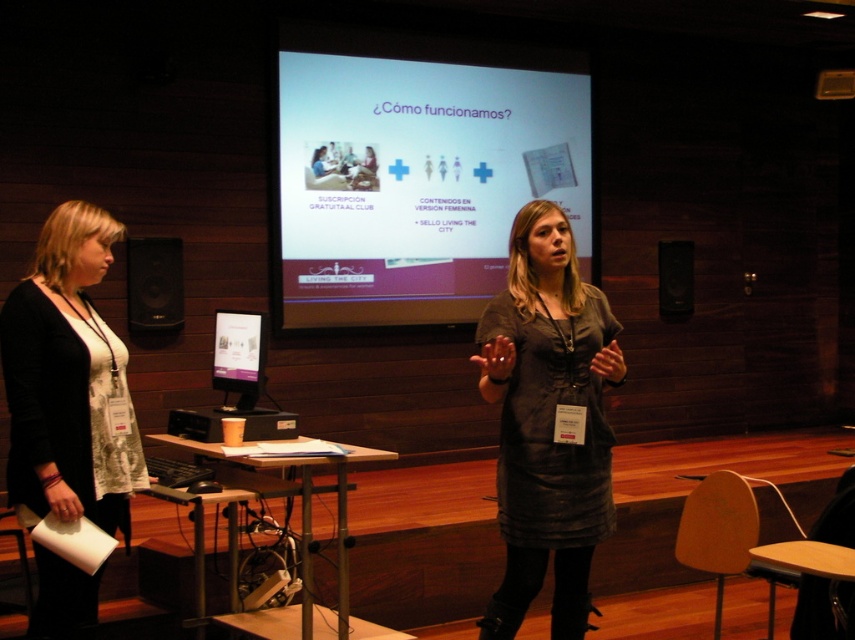
Can you confirm if matte black speaker at left is positioned to the right of matte plastic screen at center?

Incorrect, matte black speaker at left is not on the right side of matte plastic screen at center.

Which is behind, point (178, 259) or point (239, 355)?

The point (178, 259) is behind.

Is point (174, 262) farther from camera compared to point (248, 342)?

Yes, it is.

Identify the location of matte black speaker at left. Image resolution: width=855 pixels, height=640 pixels. (154, 284).

Who is higher up, dark gray dress at center or white printed dress at left?

dark gray dress at center

Who is positioned more to the right, dark gray dress at center or white printed dress at left?

dark gray dress at center is more to the right.

Is point (506, 369) closer to viewer compared to point (52, 561)?

Yes.

Where is `dark gray dress at center`? This screenshot has height=640, width=855. dark gray dress at center is located at coordinates (547, 420).

Who is shorter, white printed dress at left or matte black speaker at left?

Standing shorter between the two is matte black speaker at left.

What do you see at coordinates (68, 381) in the screenshot?
I see `white printed dress at left` at bounding box center [68, 381].

Is point (69, 236) positioned before point (136, 241)?

That is True.

Identify the location of white printed dress at left. pos(68,381).